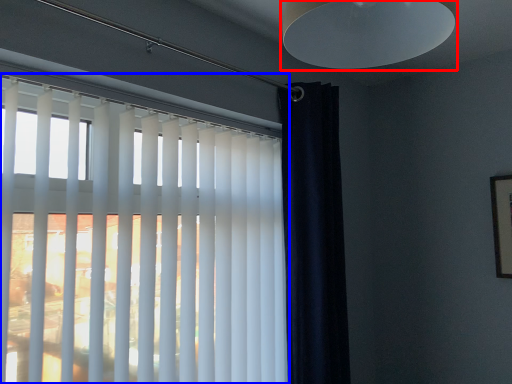
Question: Which object is further to the camera taking this photo, lamp (highlighted by a red box) or window blind (highlighted by a blue box)?

Choices:
 (A) lamp
 (B) window blind

Answer: (B)